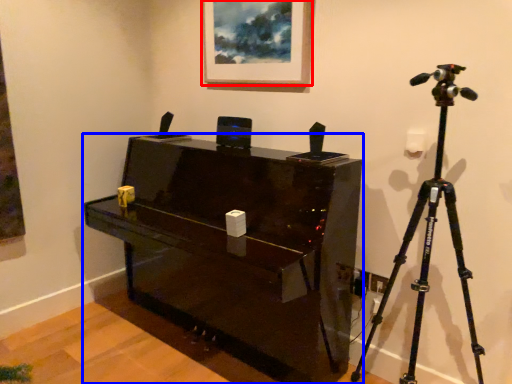
Question: Which of the following is the closest to the observer, picture frame (highlighted by a red box) or furniture (highlighted by a blue box)?

Choices:
 (A) picture frame
 (B) furniture

Answer: (B)